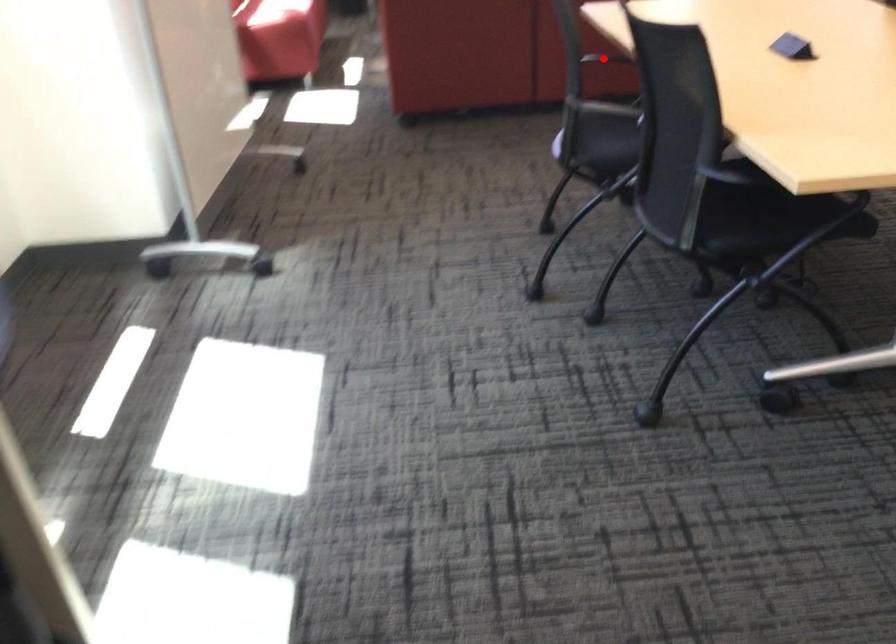
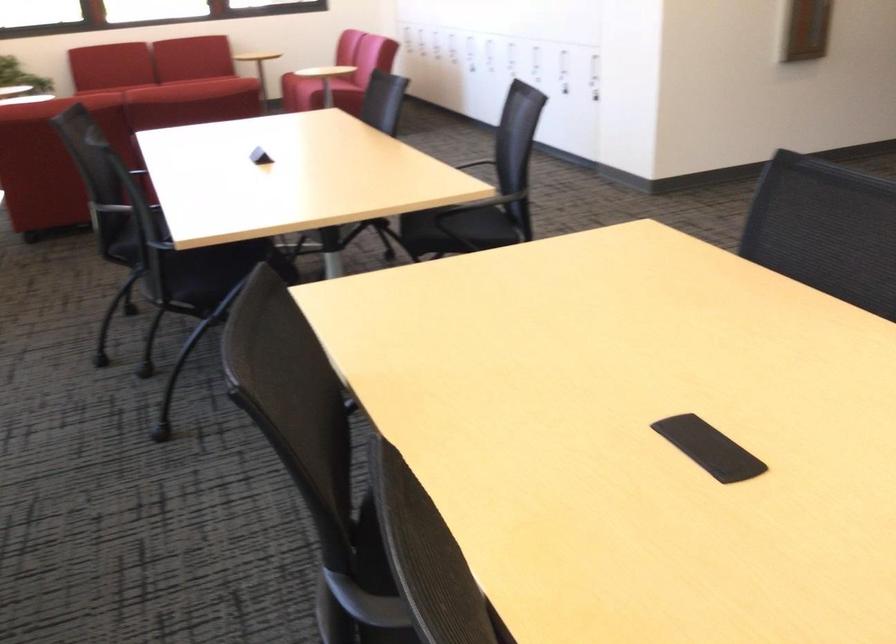
Question: I am providing you with two images of the same scene from different viewpoints. A red point is marked on the first image. Can you still see the location of the red point in image 2?

Choices:
 (A) Yes
 (B) No

Answer: (B)